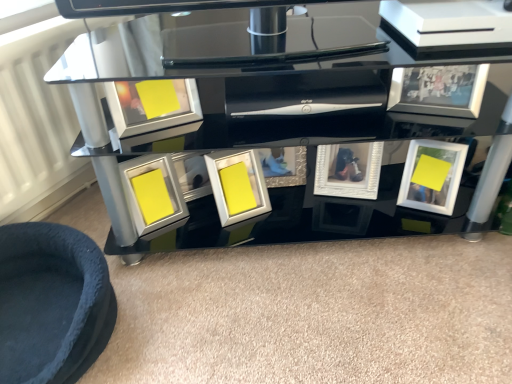
Question: Does white glossy picture frame at center, the fourth picture frame positioned from the right, lie in front of velvet blue pet bed at lower left?

Choices:
 (A) yes
 (B) no

Answer: (B)

Question: Is white glossy picture frame at center, the fourth picture frame positioned from the right, further to camera compared to velvet blue pet bed at lower left?

Choices:
 (A) no
 (B) yes

Answer: (B)

Question: Is velvet blue pet bed at lower left completely or partially inside white glossy picture frame at center, arranged as the third picture frame when viewed from the left?

Choices:
 (A) no
 (B) yes

Answer: (A)

Question: Can you confirm if white glossy picture frame at center, arranged as the third picture frame when viewed from the left, is bigger than velvet blue pet bed at lower left?

Choices:
 (A) yes
 (B) no

Answer: (B)

Question: From a real-world perspective, is white glossy picture frame at center, arranged as the third picture frame when viewed from the left, positioned under velvet blue pet bed at lower left based on gravity?

Choices:
 (A) yes
 (B) no

Answer: (B)

Question: Does white glossy picture frame at center, arranged as the third picture frame when viewed from the left, have a greater width compared to velvet blue pet bed at lower left?

Choices:
 (A) no
 (B) yes

Answer: (A)

Question: Is matte silver picture frame at upper left, which appears as the 2th picture frame when viewed from the left, surrounding matte yellow picture frame at center, which appears as the 6th picture frame when viewed from the right?

Choices:
 (A) no
 (B) yes

Answer: (A)

Question: Is matte silver picture frame at upper left, the fifth picture frame positioned from the right, positioned far away from matte yellow picture frame at center, the 1th picture frame viewed from the left?

Choices:
 (A) no
 (B) yes

Answer: (A)

Question: Does matte silver picture frame at upper left, which appears as the 2th picture frame when viewed from the left, have a larger size compared to matte yellow picture frame at center, which appears as the 6th picture frame when viewed from the right?

Choices:
 (A) no
 (B) yes

Answer: (A)

Question: Is matte silver picture frame at upper left, the fifth picture frame positioned from the right, wider than matte yellow picture frame at center, which appears as the 6th picture frame when viewed from the right?

Choices:
 (A) no
 (B) yes

Answer: (A)

Question: From a real-world perspective, does matte silver picture frame at upper left, which appears as the 2th picture frame when viewed from the left, sit lower than matte yellow picture frame at center, which appears as the 6th picture frame when viewed from the right?

Choices:
 (A) no
 (B) yes

Answer: (A)

Question: Is matte silver picture frame at upper left, which appears as the 2th picture frame when viewed from the left, positioned behind matte yellow picture frame at center, which appears as the 6th picture frame when viewed from the right?

Choices:
 (A) yes
 (B) no

Answer: (B)

Question: Is white textured frame at center, acting as the 3th picture frame starting from the right, bigger than velvet blue pet bed at lower left?

Choices:
 (A) no
 (B) yes

Answer: (A)